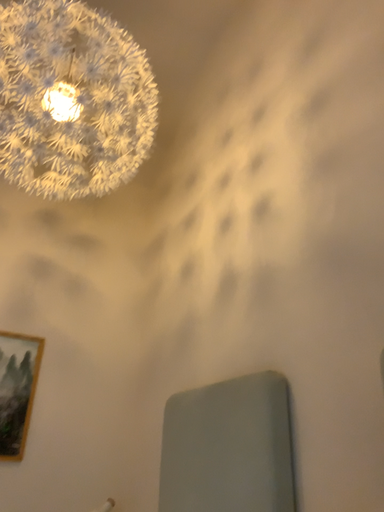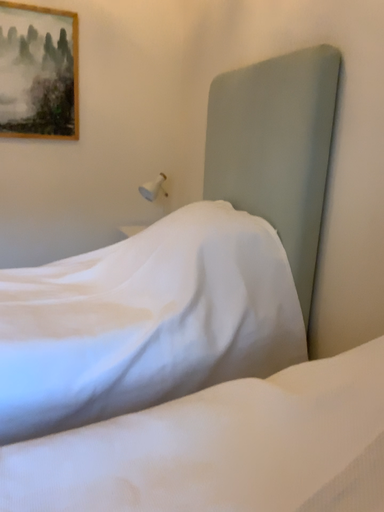
Question: Which way did the camera rotate in the video?

Choices:
 (A) rotated right
 (B) rotated left

Answer: (B)